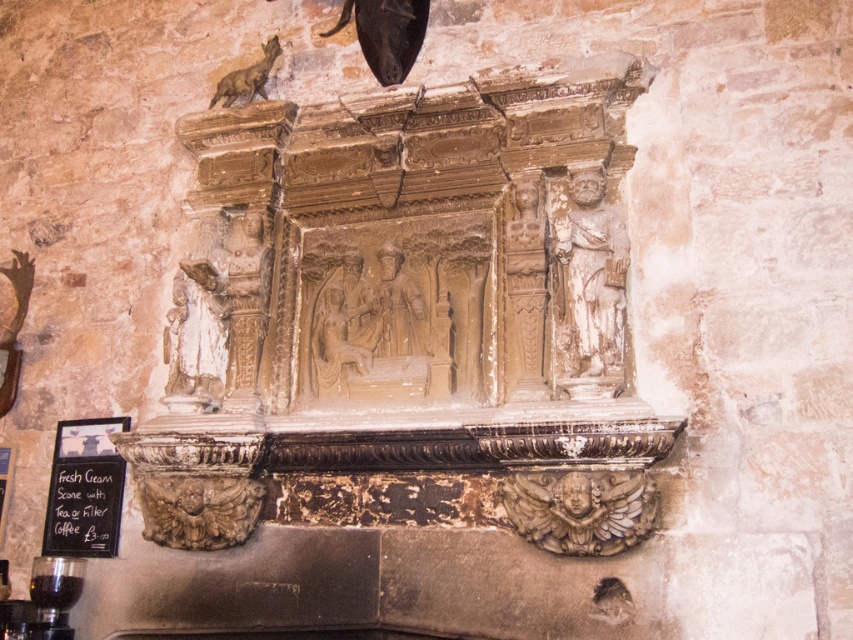
You are an art conservator examining the stone structure. You need to assess the stone statue at left and the beige stone relief at center. Based on their positions, which object is closer to the viewer?

The stone statue at left is to the left of the beige stone relief at center, so the stone statue at left is closer to the viewer.

You are an art conservator examining the stone statue at left and the beige stone relief at center. Which object is closer to your current position?

The stone statue at left is closer to your current position because it is further to the viewer than the beige stone relief at center.

You are an archaeologist examining the stone structure. You need to document the exact location of the stone statue at left. What are its coordinates?

The stone statue at left is located at coordinates point (196, 332).